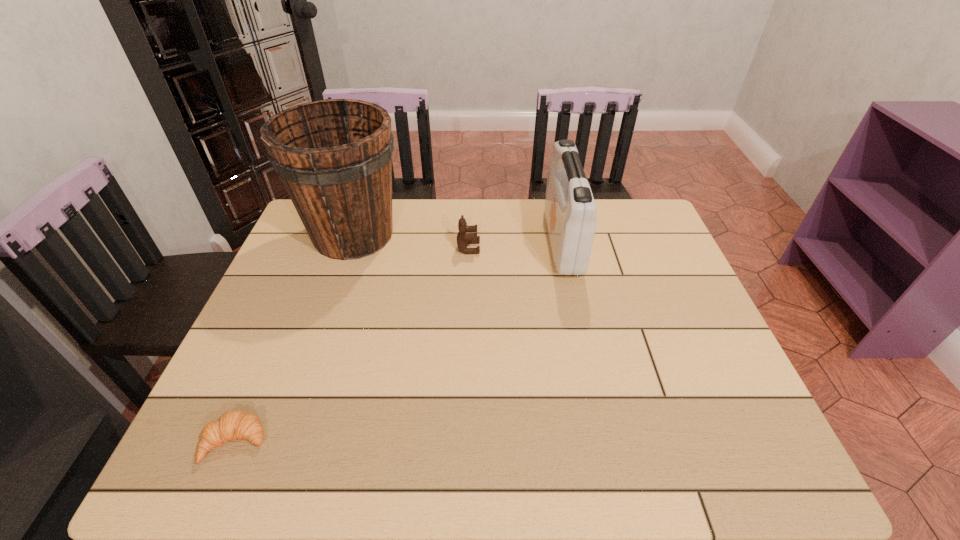
At what (x,y) coordinates should I click in order to perform the action: click on free spot between the tallest object and the teddy bear. Please return your answer as a coordinate pair (x, y). Looking at the image, I should click on (411, 241).

The image size is (960, 540). In order to click on empty location between the nearest object and the tallest object in this screenshot , I will do `click(295, 339)`.

At what (x,y) coordinates should I click in order to perform the action: click on free space between the tallest object and the third tallest object. Please return your answer as a coordinate pair (x, y). Looking at the image, I should click on (411, 241).

I want to click on free area in between the second object from right to left and the bucket, so click(x=411, y=241).

Where is `free space between the shortest object and the first-aid kit`? free space between the shortest object and the first-aid kit is located at coordinates (399, 342).

Locate an element on the screen. Image resolution: width=960 pixels, height=540 pixels. free space between the rightmost object and the crescent roll is located at coordinates (399, 342).

Select which object appears as the closest to the third object from left to right. Please provide its 2D coordinates. Your answer should be formatted as a tuple, i.e. [(x, y)], where the tuple contains the x and y coordinates of a point satisfying the conditions above.

[(334, 157)]

Point out which object is positioned as the nearest to the rightmost object. Please provide its 2D coordinates. Your answer should be formatted as a tuple, i.e. [(x, y)], where the tuple contains the x and y coordinates of a point satisfying the conditions above.

[(463, 239)]

Locate an element on the screen. Image resolution: width=960 pixels, height=540 pixels. vacant space that satisfies the following two spatial constraints: 1. on the face of the teddy bear; 2. on the front side of the crescent roll is located at coordinates (463, 442).